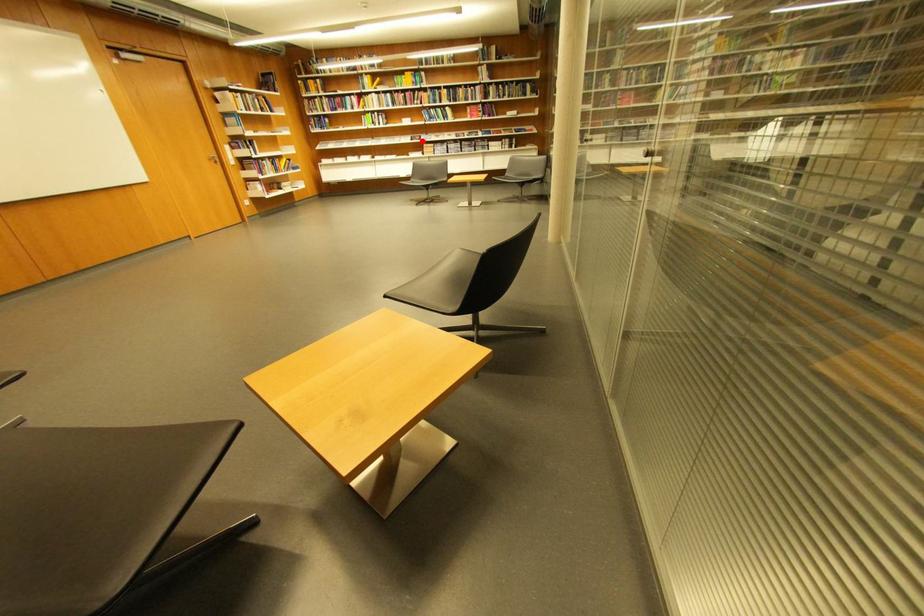
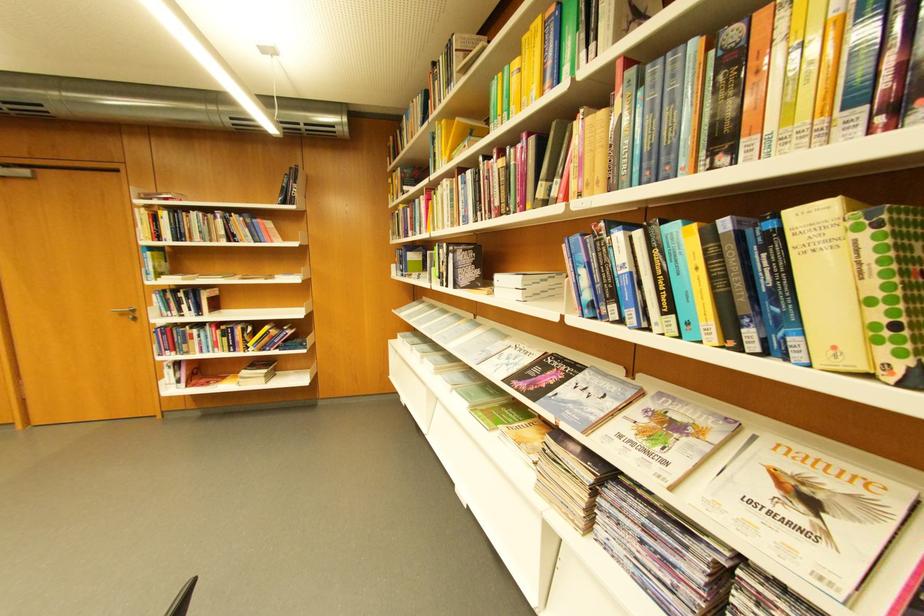
Find the pixel in the second image that matches the highlighted location in the first image.

(532, 377)